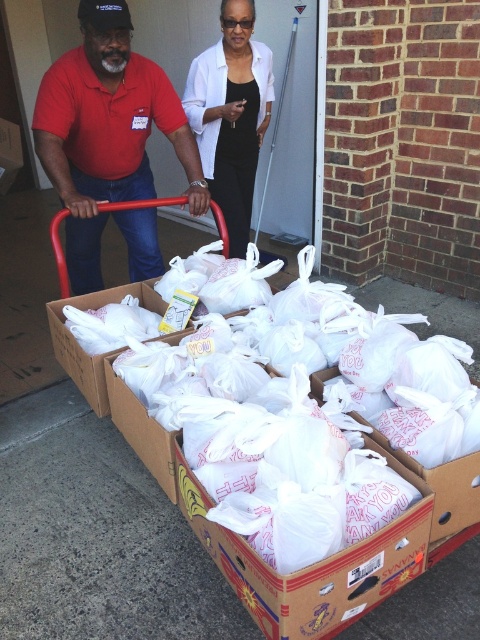
Between point (144, 134) and point (211, 52), which one is positioned in front?

Positioned in front is point (144, 134).

Is point (177, 102) farther from camera compared to point (214, 140)?

No.

At what (x,y) coordinates should I click in order to perform the action: click on matte red shirt at center. Please return your answer as a coordinate pair (x, y). Looking at the image, I should click on (107, 131).

This screenshot has height=640, width=480. I want to click on matte red shirt at center, so click(107, 131).